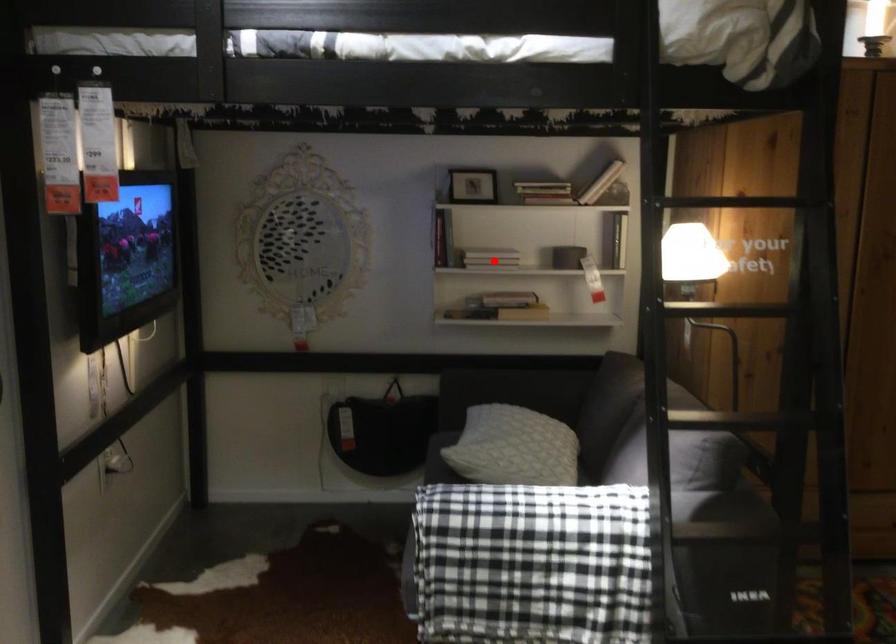
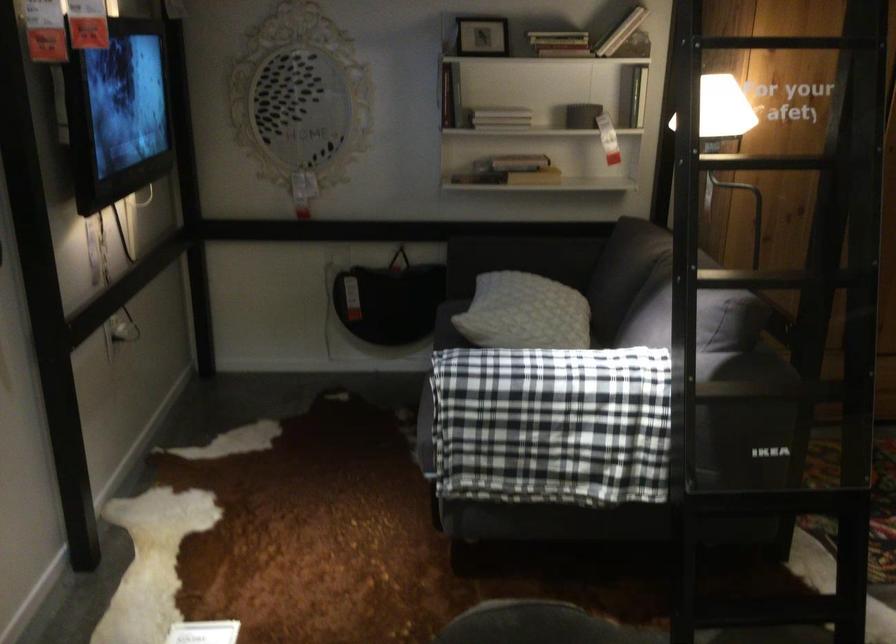
Where in the second image is the point corresponding to the highlighted location from the first image?

(500, 118)